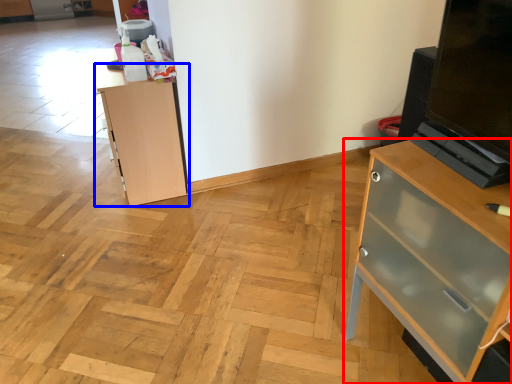
Question: Among these objects, which one is nearest to the camera, chest of drawers (highlighted by a red box) or cupboard (highlighted by a blue box)?

Choices:
 (A) chest of drawers
 (B) cupboard

Answer: (A)